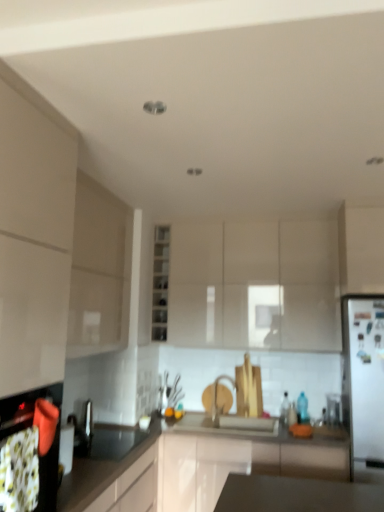
Where is `vacant area to the left of silver metallic faucet at center`? Image resolution: width=384 pixels, height=512 pixels. vacant area to the left of silver metallic faucet at center is located at coordinates (203, 419).